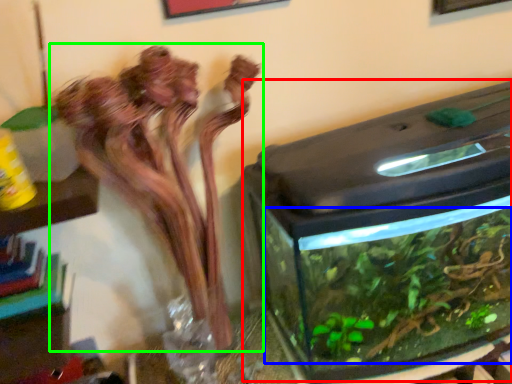
Question: Which object is the farthest from water tank (highlighted by a red box)? Choose among these: plant (highlighted by a blue box) or houseplant (highlighted by a green box).

Choices:
 (A) plant
 (B) houseplant

Answer: (B)